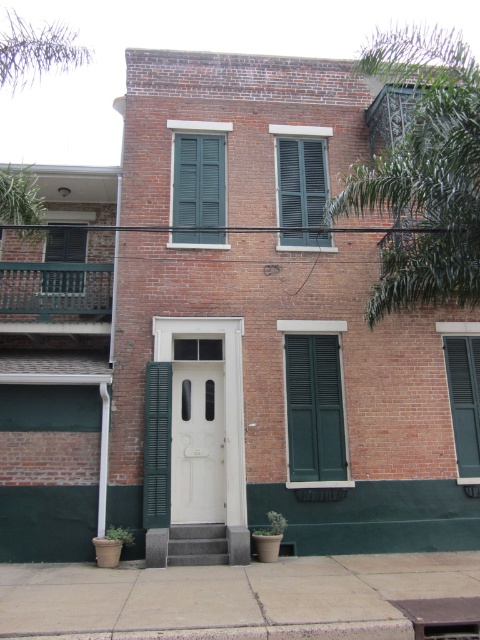
Is white glossy door at center to the right of green matte shutter at left from the viewer's perspective?

Yes, white glossy door at center is to the right of green matte shutter at left.

Between point (215, 419) and point (56, 244), which one is positioned in front?

Point (215, 419) is more forward.

This screenshot has width=480, height=640. Find the location of `white glossy door at center`. white glossy door at center is located at coordinates (196, 444).

Between white glossy door at center and green matte shutter at right, which one has more height?

white glossy door at center

Can you confirm if white glossy door at center is positioned to the right of green matte shutter at right?

Incorrect, white glossy door at center is not on the right side of green matte shutter at right.

Is point (181, 381) positioned behind point (458, 355)?

No, it is in front of (458, 355).

Locate an element on the screen. The height and width of the screenshot is (640, 480). white glossy door at center is located at coordinates (196, 444).

Is green matte shutters at center smaller than green matte shutter at left?

No.

Does green matte shutters at center appear under green matte shutter at left?

No, green matte shutters at center is not below green matte shutter at left.

Which is in front, point (194, 205) or point (43, 278)?

Point (43, 278)

Locate an element on the screen. green matte shutters at center is located at coordinates (199, 188).